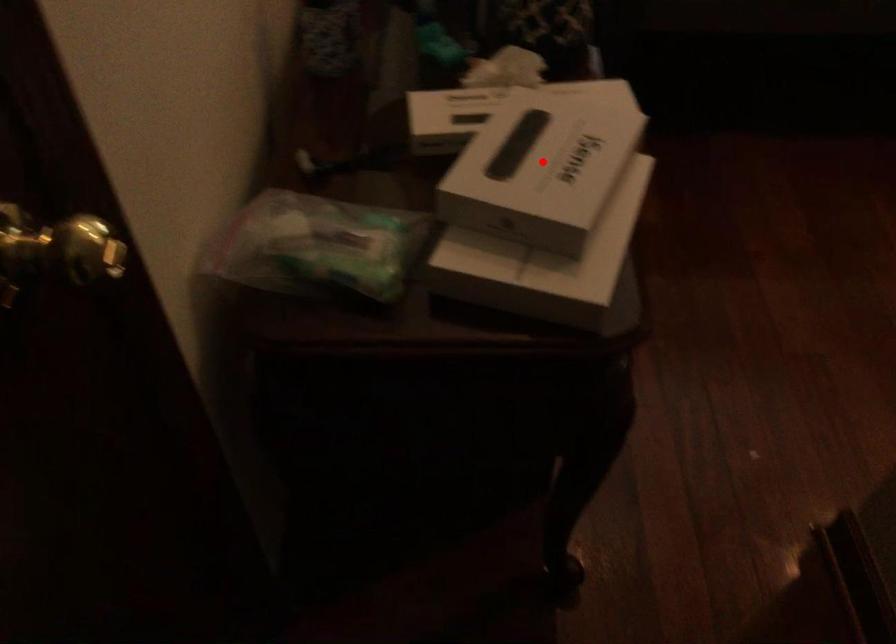
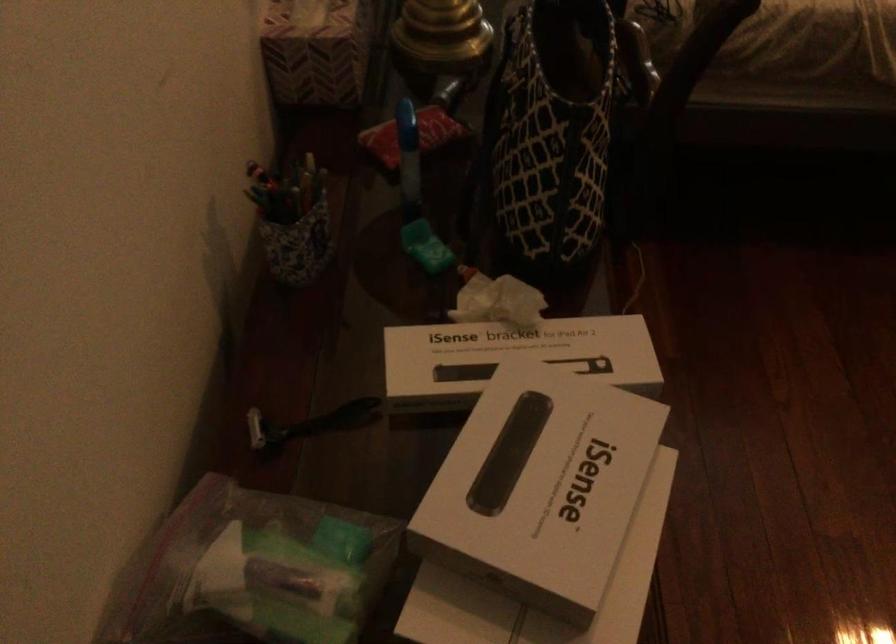
Question: I am providing you with two images of the same scene from different viewpoints. Given a red point in image1, look at the same physical point in image2. Is it:

Choices:
 (A) Closer to the viewpoint
 (B) Farther from the viewpoint

Answer: (A)